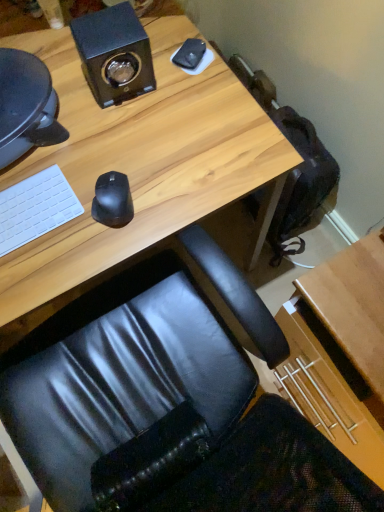
Where is `free point behind white matte keyboard at left`? free point behind white matte keyboard at left is located at coordinates (48, 151).